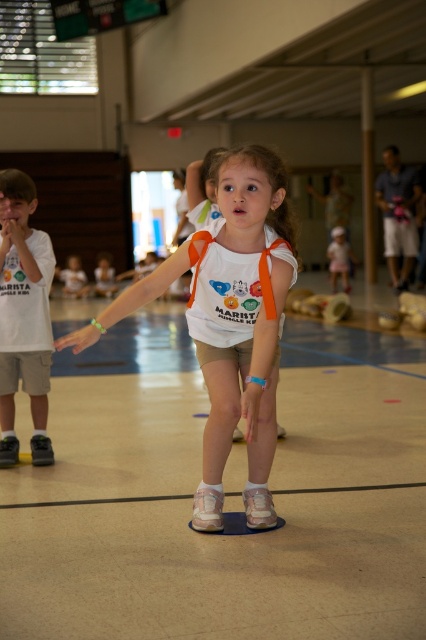
Is the position of matte white shirt at left more distant than that of pink fabric dress at center?

No, matte white shirt at left is closer to the viewer.

Does matte white shirt at left appear over pink fabric dress at center?

Actually, matte white shirt at left is below pink fabric dress at center.

Locate an element on the screen. The width and height of the screenshot is (426, 640). matte white shirt at left is located at coordinates (x=23, y=316).

At what (x,y) coordinates should I click in order to perform the action: click on matte white shirt at left. Please return your answer as a coordinate pair (x, y). This screenshot has height=640, width=426. Looking at the image, I should click on (23, 316).

Does white matte tank top at center appear on the right side of pink fabric dress at center?

No, white matte tank top at center is not to the right of pink fabric dress at center.

Consider the image. Does white matte tank top at center lie in front of pink fabric dress at center?

Yes, it is.

Is point (253, 266) more distant than point (340, 236)?

That is False.

The image size is (426, 640). I want to click on white matte tank top at center, so click(230, 323).

Can you confirm if white matte tank top at center is shorter than matte white shirt at left?

Indeed, white matte tank top at center has a lesser height compared to matte white shirt at left.

Is white matte tank top at center smaller than matte white shirt at left?

Actually, white matte tank top at center might be larger than matte white shirt at left.

Which is behind, point (245, 198) or point (22, 330)?

Point (22, 330)

Where is `white matte tank top at center`? The width and height of the screenshot is (426, 640). white matte tank top at center is located at coordinates tap(230, 323).